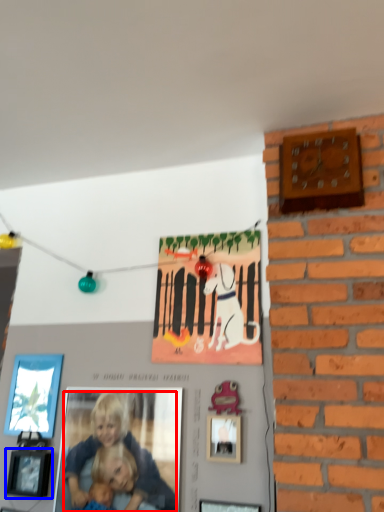
Question: Which object is closer to the camera taking this photo, person (highlighted by a red box) or picture frame (highlighted by a blue box)?

Choices:
 (A) person
 (B) picture frame

Answer: (A)